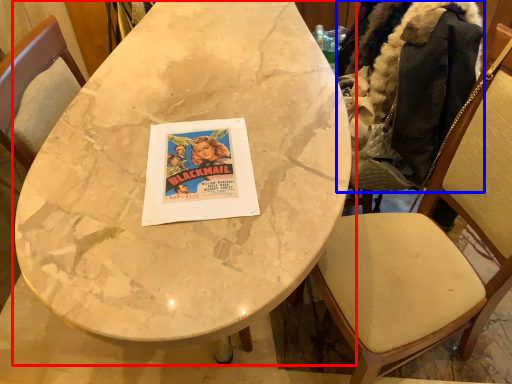
Question: Which object appears closest to the camera in this image, table (highlighted by a red box) or jacket (highlighted by a blue box)?

Choices:
 (A) table
 (B) jacket

Answer: (A)